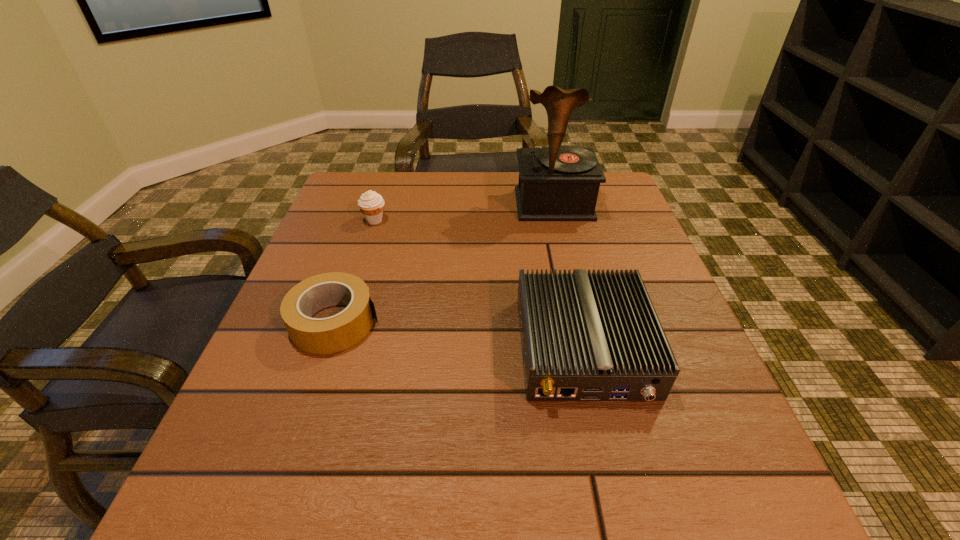
Where is `phonograph_record`? phonograph_record is located at coordinates (560, 183).

Identify the location of muffin. (371, 204).

This screenshot has height=540, width=960. What are the coordinates of `router` in the screenshot? It's located at (585, 337).

You are a GUI agent. You are given a task and a screenshot of the screen. Output one action in this format:
    pyautogui.click(x=<x>, y=<y>)
    Task: Click on the shortest object
    This screenshot has height=540, width=960.
    Given the screenshot: What is the action you would take?
    pyautogui.click(x=333, y=334)

Where is `free location located 0.210m at the horn opening of the phonograph_record`? free location located 0.210m at the horn opening of the phonograph_record is located at coordinates (572, 280).

The width and height of the screenshot is (960, 540). I want to click on vacant space situated 0.070m on the front of the muffin, so click(366, 246).

The height and width of the screenshot is (540, 960). Identify the location of vacant area situated 0.070m on the back panel of the router. (609, 457).

Where is `vacant space situated at the edge of the shortest object`? Image resolution: width=960 pixels, height=540 pixels. vacant space situated at the edge of the shortest object is located at coordinates (571, 322).

Find the location of a particular element. This screenshot has height=540, width=960. phonograph_record at the far edge is located at coordinates (560, 183).

This screenshot has height=540, width=960. I want to click on muffin that is at the far edge, so click(371, 204).